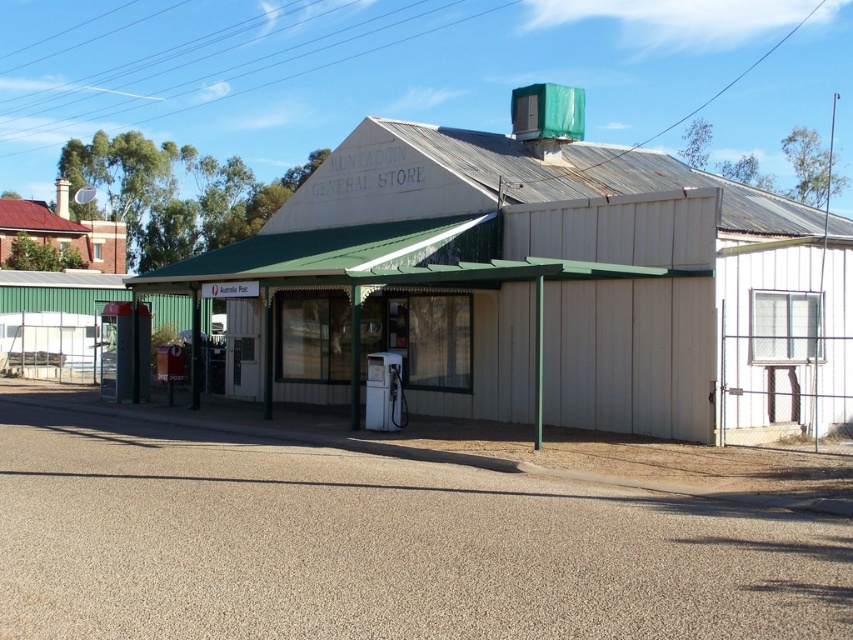
Is white wood building at center positioned before red tiled roof at upper left?

Yes, white wood building at center is in front of red tiled roof at upper left.

Measure the distance between white wood building at center and camera.

white wood building at center and camera are 43.21 feet apart.

Who is more forward, (373,204) or (82,236)?

Point (373,204)

Where is `white wood building at center`? white wood building at center is located at coordinates (538, 284).